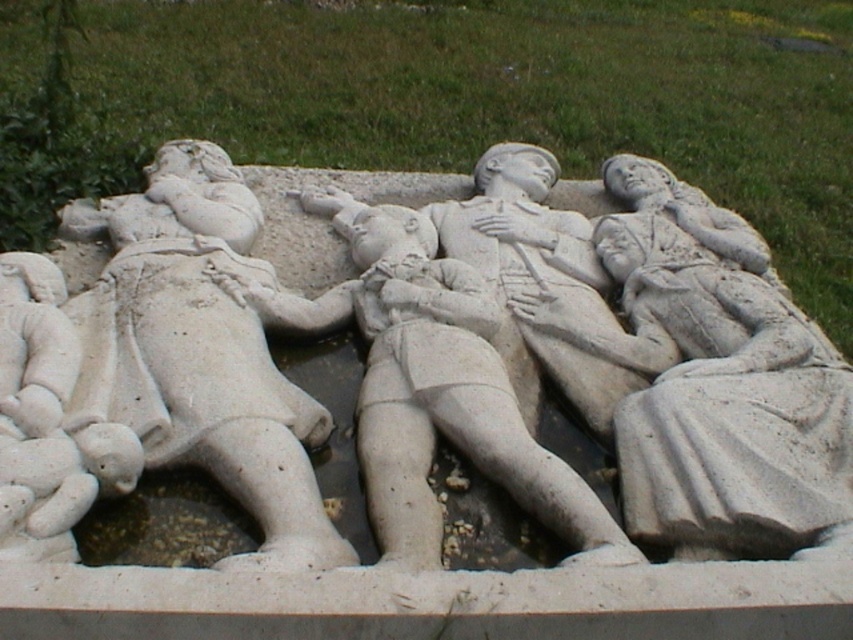
You are an archaeologist examining a stone relief sculpture. You notice two points of interest labeled as point 1 and point 2. Point 1 is at coordinates point (570, 339) and point 2 is at point (508, 396). Based on the sculpture, which point is closer to the viewer?

Point 2 at point (508, 396) is closer to the viewer than point 1 at point (570, 339) because the description states that point (570, 339) is behind point (508, 396).

You are an art conservator examining the stone relief sculpture. You need to determine which of the two figures, the white stone figure at left or the white stone figure at center, requires a wider protective covering. Based on their sizes, which one needs a larger covering?

The white stone figure at left requires a larger protective covering because its width is greater than that of the white stone figure at center.

You are an art conservator examining the white stone sculpture at center and the white stone figure at center. Which object has a greater width according to the description?

The white stone sculpture at center has a greater width than the white stone figure at center.